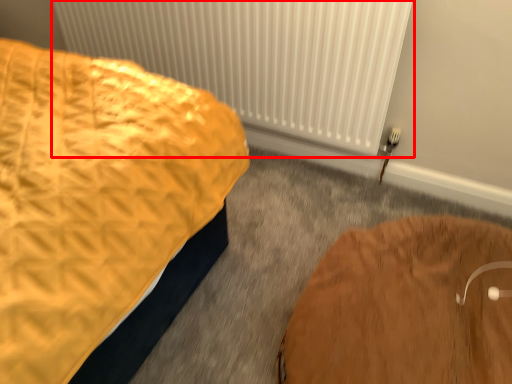
Question: In this image, where is radiator (annotated by the red box) located relative to furniture?

Choices:
 (A) left
 (B) right

Answer: (A)